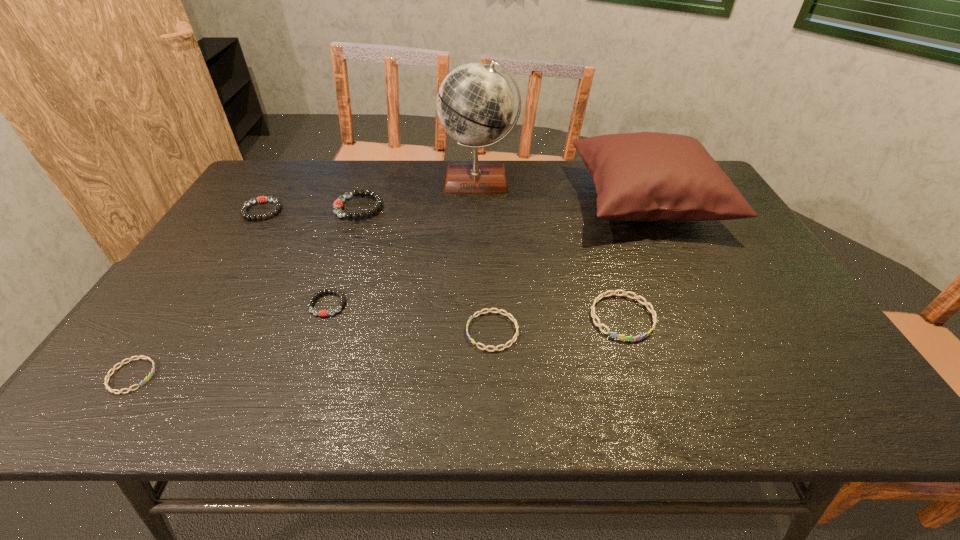
Locate an element on the screen. vacant space located 0.200m on the front of the nearest black bracelet is located at coordinates (297, 393).

This screenshot has height=540, width=960. Identify the location of vacant region located 0.160m on the surface of the nearest bracelet showing star-shaped elements. (230, 376).

This screenshot has height=540, width=960. I want to click on globe that is at the far edge, so click(475, 104).

Where is `cushion positioned at the far edge`? The image size is (960, 540). cushion positioned at the far edge is located at coordinates (645, 176).

The width and height of the screenshot is (960, 540). I want to click on bracelet positioned at the far edge, so click(337, 207).

Locate an element on the screen. object located at the near edge is located at coordinates (146, 379).

Where is `object located in the right edge section of the desktop`? object located in the right edge section of the desktop is located at coordinates (645, 176).

Image resolution: width=960 pixels, height=540 pixels. I want to click on object that is at the near left corner, so click(x=146, y=379).

You are a GUI agent. You are given a task and a screenshot of the screen. Output one action in this format:
    pyautogui.click(x=<x>, y=<y>)
    Task: Click on the object located in the far right corner section of the desktop
    The image size is (960, 540).
    Given the screenshot: What is the action you would take?
    pyautogui.click(x=645, y=176)

In the image, there is a desktop. Identify the location of vacant space at the far edge. The width and height of the screenshot is (960, 540). (349, 178).